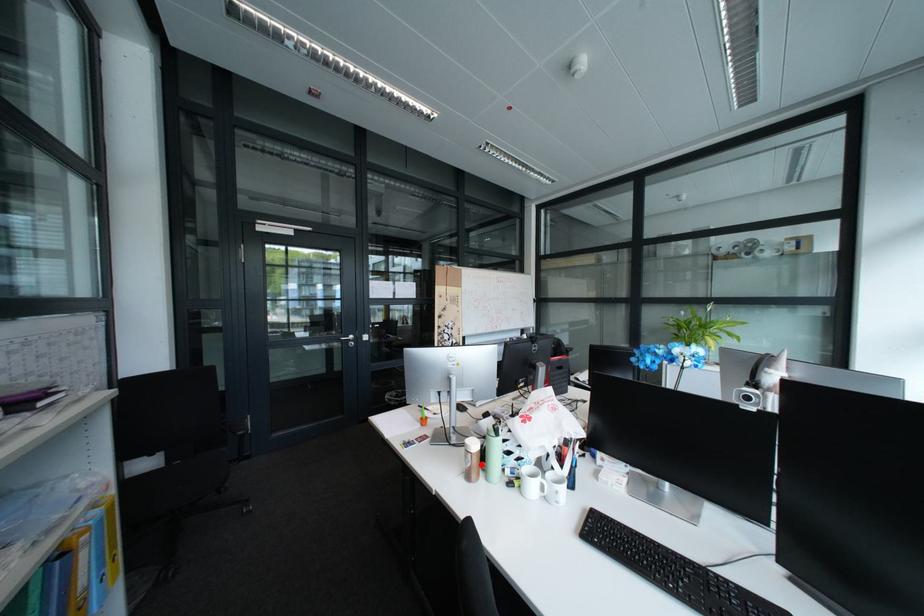
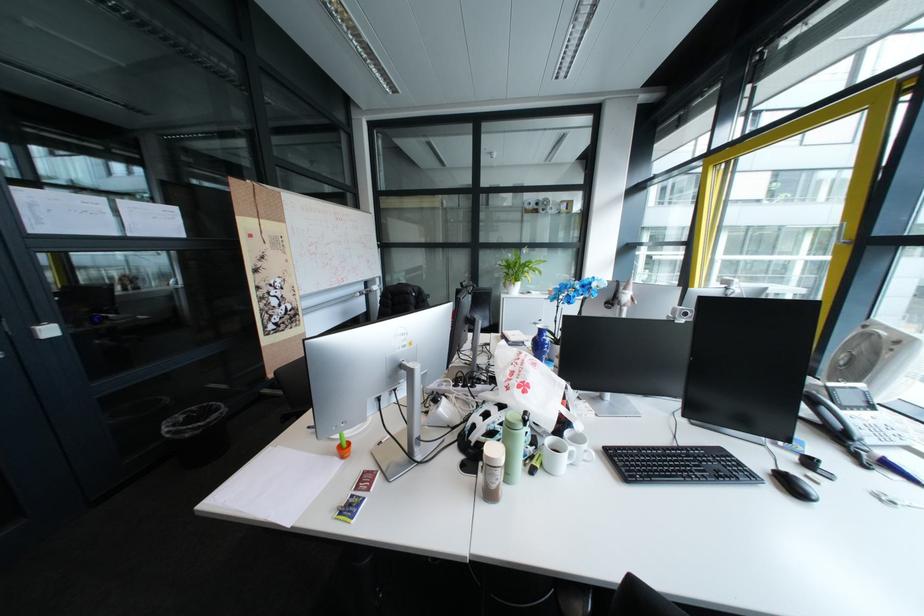
Question: I am providing you with two images of the same scene from different viewpoints. In image1, a red point is highlighted. Considering the same 3D point in image2, which of the following is correct?

Choices:
 (A) It is closer
 (B) It is farther

Answer: (B)